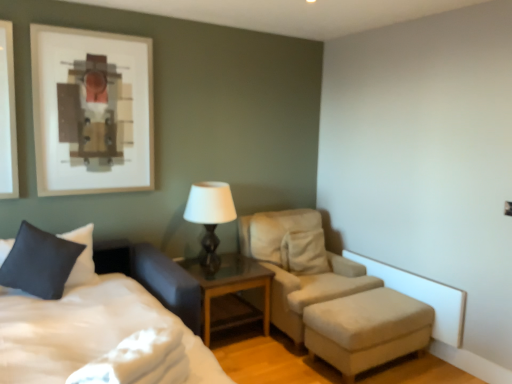
Question: From the image's perspective, is beige fabric ottoman at lower right over glass wood nightstand at center?

Choices:
 (A) no
 (B) yes

Answer: (A)

Question: Is beige fabric ottoman at lower right not within glass wood nightstand at center?

Choices:
 (A) no
 (B) yes

Answer: (B)

Question: Can you confirm if beige fabric ottoman at lower right is shorter than glass wood nightstand at center?

Choices:
 (A) no
 (B) yes

Answer: (B)

Question: Is beige fabric ottoman at lower right touching glass wood nightstand at center?

Choices:
 (A) yes
 (B) no

Answer: (B)

Question: Is beige fabric ottoman at lower right thinner than glass wood nightstand at center?

Choices:
 (A) yes
 (B) no

Answer: (A)

Question: Based on their sizes in the image, would you say matte black table lamp at center is bigger or smaller than beige fabric ottoman at lower right?

Choices:
 (A) big
 (B) small

Answer: (B)

Question: From a real-world perspective, is matte black table lamp at center above or below beige fabric ottoman at lower right?

Choices:
 (A) above
 (B) below

Answer: (A)

Question: Is point (230, 215) closer or farther from the camera than point (309, 314)?

Choices:
 (A) closer
 (B) farther

Answer: (B)

Question: From the image's perspective, is matte black table lamp at center above or below beige fabric ottoman at lower right?

Choices:
 (A) below
 (B) above

Answer: (B)

Question: Is beige fabric ottoman at lower right wider or thinner than dark blue fabric pillow at lower left?

Choices:
 (A) thin
 (B) wide

Answer: (B)

Question: Considering the positions of beige fabric ottoman at lower right and dark blue fabric pillow at lower left in the image, is beige fabric ottoman at lower right taller or shorter than dark blue fabric pillow at lower left?

Choices:
 (A) tall
 (B) short

Answer: (B)

Question: Considering the relative positions of beige fabric ottoman at lower right and dark blue fabric pillow at lower left in the image provided, is beige fabric ottoman at lower right to the left or to the right of dark blue fabric pillow at lower left?

Choices:
 (A) left
 (B) right

Answer: (B)

Question: From the image's perspective, relative to dark blue fabric pillow at lower left, is beige fabric ottoman at lower right above or below?

Choices:
 (A) below
 (B) above

Answer: (A)

Question: Is dark blue fabric pillow at lower left in front of or behind matte black table lamp at center in the image?

Choices:
 (A) front
 (B) behind

Answer: (A)

Question: Is dark blue fabric pillow at lower left taller or shorter than matte black table lamp at center?

Choices:
 (A) tall
 (B) short

Answer: (B)